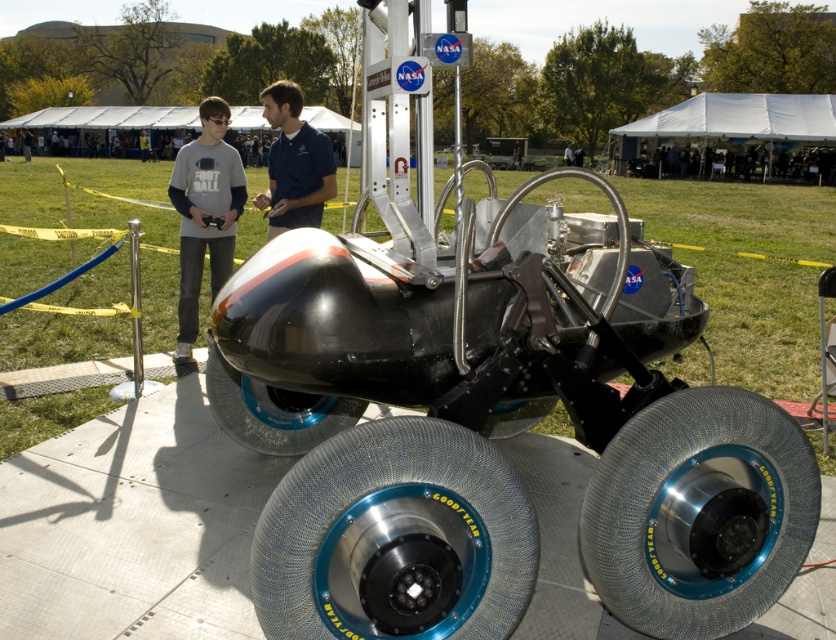
Can you confirm if metallic mesh tire at lower right is bigger than shiny metallic wheel at center?

No, metallic mesh tire at lower right is not bigger than shiny metallic wheel at center.

Is point (686, 440) closer to viewer compared to point (358, 419)?

Yes, it is.

This screenshot has height=640, width=836. Find the location of `metallic mesh tire at lower right`. metallic mesh tire at lower right is located at coordinates (699, 513).

This screenshot has height=640, width=836. What do you see at coordinates (204, 212) in the screenshot?
I see `gray cotton shirt at left` at bounding box center [204, 212].

Who is more forward, (212, 252) or (271, 164)?

Point (271, 164) is in front.

This screenshot has height=640, width=836. I want to click on gray cotton shirt at left, so coord(204,212).

Image resolution: width=836 pixels, height=640 pixels. Identify the location of gray cotton shirt at left. (204, 212).

Can you confirm if metallic mesh tire at lower right is thinner than blue cotton shirt at center?

No, metallic mesh tire at lower right is not thinner than blue cotton shirt at center.

Is metallic mesh tire at lower right to the right of blue cotton shirt at center from the viewer's perspective?

Yes, metallic mesh tire at lower right is to the right of blue cotton shirt at center.

Between point (615, 532) and point (274, 99), which one is positioned in front?

Positioned in front is point (615, 532).

Where is `metallic mesh tire at lower right`? metallic mesh tire at lower right is located at coordinates (699, 513).